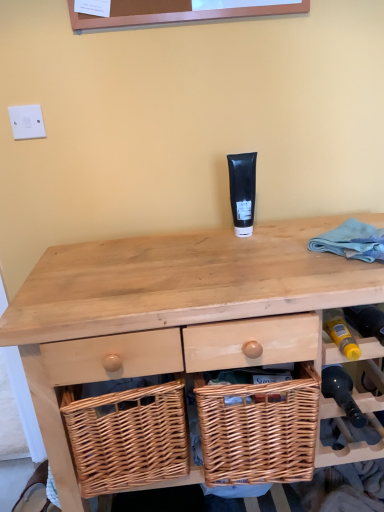
The height and width of the screenshot is (512, 384). In order to click on vacant point above natural wood desk at center (from a real-world perspective) in this screenshot , I will do `click(219, 260)`.